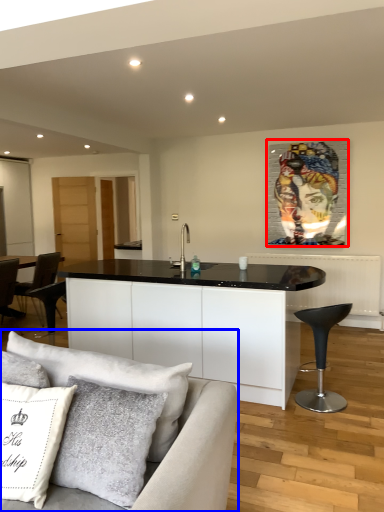
Question: Which point is closer to the camera, picture frame (highlighted by a red box) or studio couch (highlighted by a blue box)?

Choices:
 (A) picture frame
 (B) studio couch

Answer: (B)